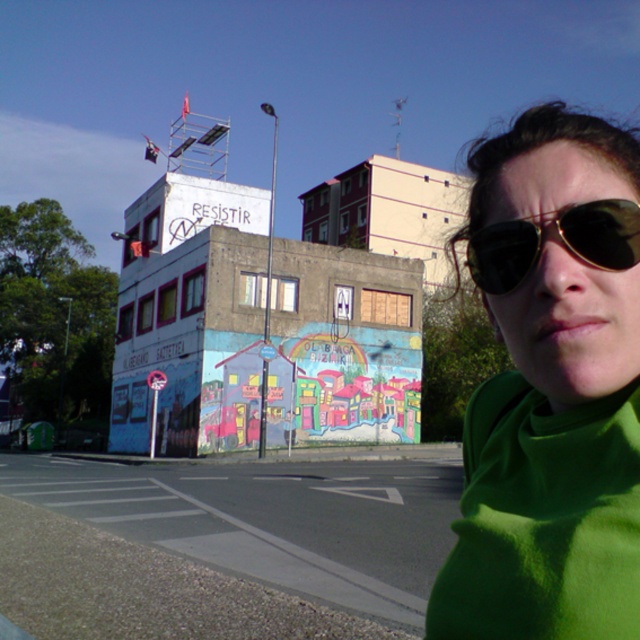
Question: Does green fleece at center have a lesser width compared to gold reflective sunglasses at right?

Choices:
 (A) no
 (B) yes

Answer: (A)

Question: Is green fleece at center to the left of gold reflective sunglasses at right from the viewer's perspective?

Choices:
 (A) yes
 (B) no

Answer: (B)

Question: Which object is closer to the camera taking this photo?

Choices:
 (A) gold reflective sunglasses at right
 (B) green fleece at center

Answer: (A)

Question: Where is green fleece at center located in relation to gold reflective sunglasses at right in the image?

Choices:
 (A) right
 (B) left

Answer: (A)

Question: Which object is closer to the camera taking this photo?

Choices:
 (A) green fleece at center
 (B) gold reflective sunglasses at right

Answer: (B)